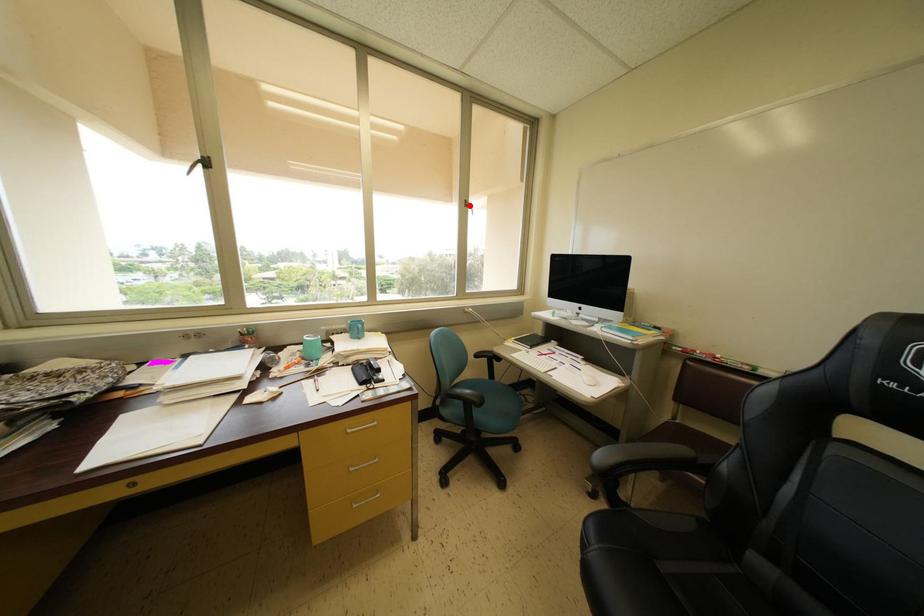
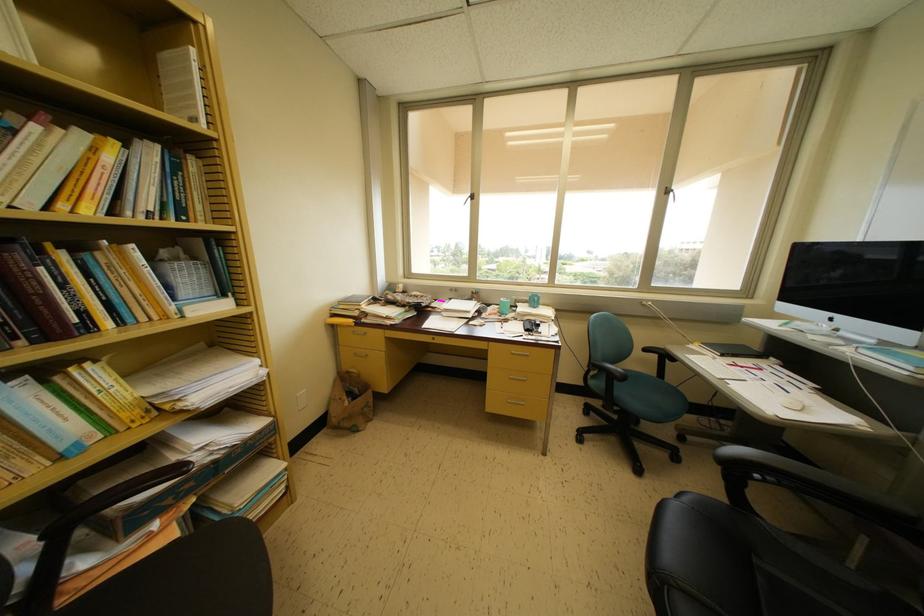
Locate, in the second image, the point that corresponds to the highlighted location in the first image.

(671, 193)